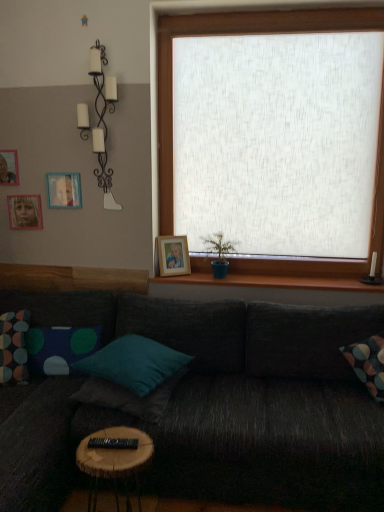
This screenshot has width=384, height=512. I want to click on vacant space that is in between wooden picture frame at center, which is the 4th picture frame in left-to-right order, and green matte plant at center, so click(184, 276).